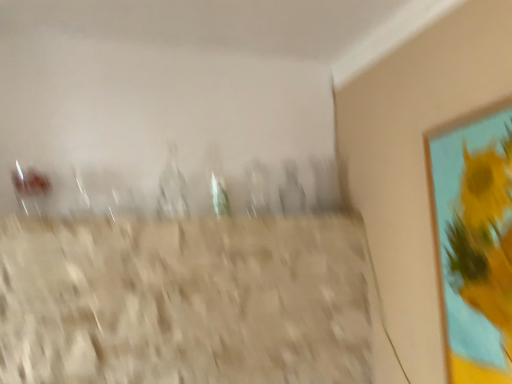
The image size is (512, 384). I want to click on matte yellow painting at right, so click(x=475, y=242).

What do you see at coordinates (475, 242) in the screenshot? Image resolution: width=512 pixels, height=384 pixels. I see `matte yellow painting at right` at bounding box center [475, 242].

Where is `matte yellow painting at right`? Image resolution: width=512 pixels, height=384 pixels. matte yellow painting at right is located at coordinates pos(475,242).